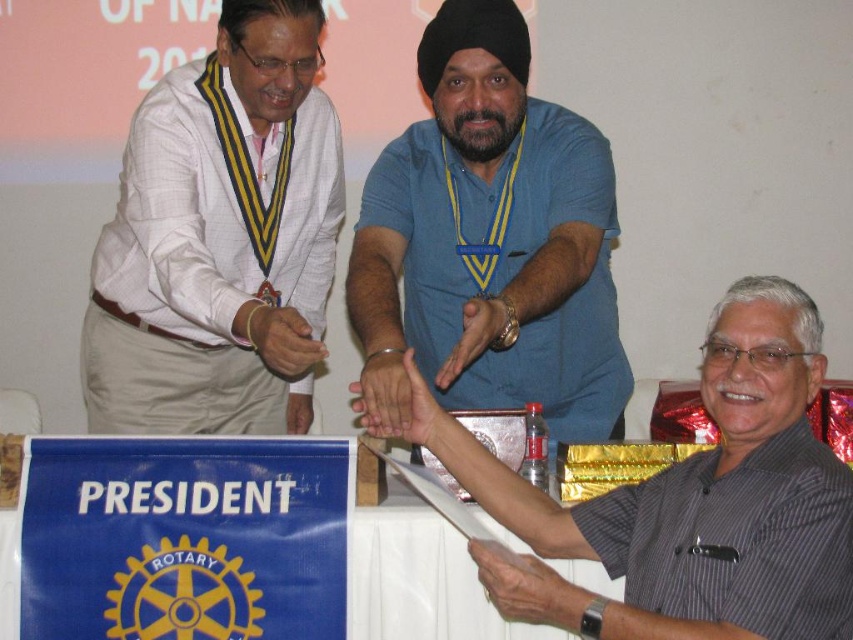
Does point (508, 52) come in front of point (743, 497)?

No.

Does blue cotton shirt at center have a smaller size compared to gray striped shirt at center?

Actually, blue cotton shirt at center might be larger than gray striped shirt at center.

This screenshot has height=640, width=853. I want to click on blue cotton shirt at center, so click(489, 243).

Who is positioned more to the left, white textured shirt at left or gray striped shirt at center?

white textured shirt at left

Which of these two, white textured shirt at left or gray striped shirt at center, stands shorter?

gray striped shirt at center is shorter.

Is point (201, 124) in front of point (816, 387)?

No, it is not.

Locate an element on the screen. The image size is (853, 640). white textured shirt at left is located at coordinates (219, 240).

Is white textured shirt at left above blue cotton shirt at center?

Yes.

Does white textured shirt at left have a larger size compared to blue cotton shirt at center?

Yes.

Between point (296, 163) and point (374, 202), which one is positioned in front?

Point (374, 202) is in front.

This screenshot has height=640, width=853. I want to click on white textured shirt at left, so coord(219,240).